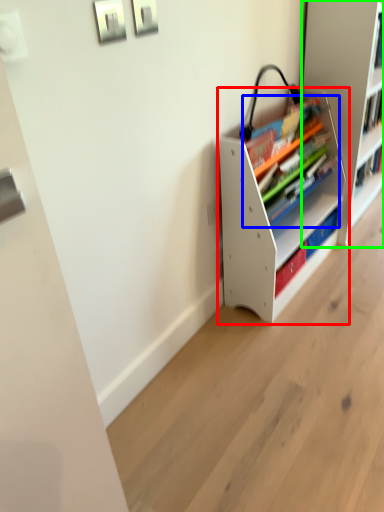
Question: Estimate the real-world distances between objects in this image. Which object is closer to shelf (highlighted by a red box), book (highlighted by a blue box) or shelf (highlighted by a green box)?

Choices:
 (A) book
 (B) shelf

Answer: (A)